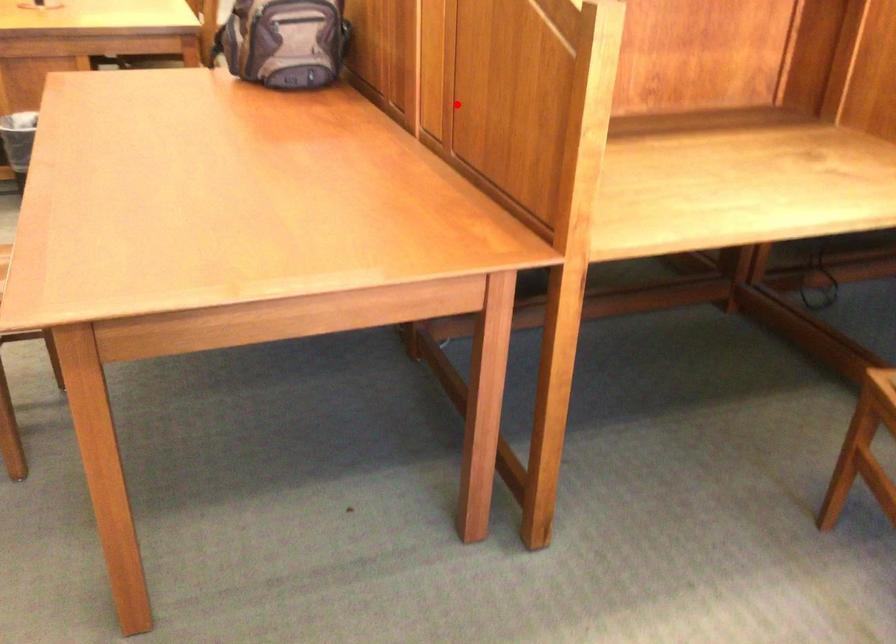
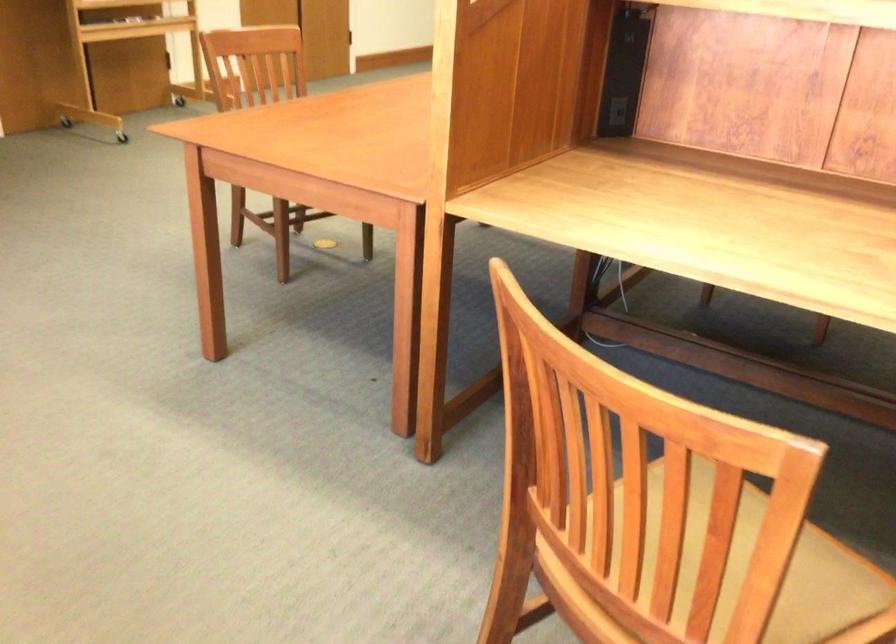
Question: I am providing you with two images of the same scene from different viewpoints. A red point is shown in image1. For the corresponding object point in image2, is it positioned nearer or farther from the camera?

Choices:
 (A) Nearer
 (B) Farther

Answer: (B)